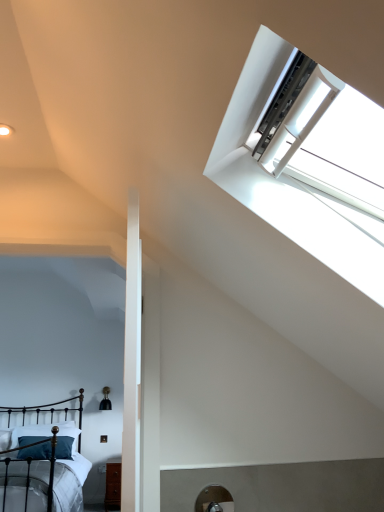
In order to click on dark blue fabric pillow at lower left in this screenshot , I will do `click(35, 448)`.

Describe the element at coordinates (42, 483) in the screenshot. I see `black wrought iron bed at lower left` at that location.

Locate an element on the screen. Image resolution: width=384 pixels, height=512 pixels. white plastic window at upper right is located at coordinates (309, 163).

The width and height of the screenshot is (384, 512). I want to click on dark blue fabric pillow at lower left, so click(x=35, y=448).

Considering the sizes of objects dark blue fabric pillow at lower left and white plastic window at upper right in the image provided, who is taller, dark blue fabric pillow at lower left or white plastic window at upper right?

Standing taller between the two is white plastic window at upper right.

Does dark blue fabric pillow at lower left turn towards white plastic window at upper right?

No, dark blue fabric pillow at lower left is not turned towards white plastic window at upper right.

Locate an element on the screen. The height and width of the screenshot is (512, 384). window that appears on the right of dark blue fabric pillow at lower left is located at coordinates (309, 163).

Considering the sizes of objects black wrought iron bed at lower left and white plastic window at upper right in the image provided, who is wider, black wrought iron bed at lower left or white plastic window at upper right?

With larger width is black wrought iron bed at lower left.

Can white plastic window at upper right be found inside black wrought iron bed at lower left?

No, white plastic window at upper right is not a part of black wrought iron bed at lower left.

What's the angular difference between black wrought iron bed at lower left and white plastic window at upper right's facing directions?

The facing directions of black wrought iron bed at lower left and white plastic window at upper right are 91.4 degrees apart.

Considering the sizes of objects black wrought iron bed at lower left and white plastic window at upper right in the image provided, who is shorter, black wrought iron bed at lower left or white plastic window at upper right?

white plastic window at upper right is shorter.

Do you think white plastic window at upper right is within black wrought iron bed at lower left, or outside of it?

white plastic window at upper right lies outside black wrought iron bed at lower left.

From the image's perspective, would you say white plastic window at upper right is positioned over black wrought iron bed at lower left?

Yes, from the image's perspective, white plastic window at upper right is on top of black wrought iron bed at lower left.

Which object is thinner, white plastic window at upper right or black wrought iron bed at lower left?

white plastic window at upper right.

At what (x,y) coordinates should I click in order to perform the action: click on window that appears in front of the black wrought iron bed at lower left. Please return your answer as a coordinate pair (x, y). This screenshot has height=512, width=384. Looking at the image, I should click on pyautogui.click(x=309, y=163).

Could you tell me if black wrought iron bed at lower left is turned towards dark blue fabric pillow at lower left?

Yes.

In terms of height, does black wrought iron bed at lower left look taller or shorter compared to dark blue fabric pillow at lower left?

Considering their sizes, black wrought iron bed at lower left has more height than dark blue fabric pillow at lower left.

Considering the sizes of black wrought iron bed at lower left and dark blue fabric pillow at lower left in the image, is black wrought iron bed at lower left wider or thinner than dark blue fabric pillow at lower left?

In the image, black wrought iron bed at lower left appears to be wider than dark blue fabric pillow at lower left.

Considering their positions, is black wrought iron bed at lower left located in front of or behind dark blue fabric pillow at lower left?

Clearly, black wrought iron bed at lower left is in front of dark blue fabric pillow at lower left.

Is dark blue fabric pillow at lower left inside the boundaries of black wrought iron bed at lower left, or outside?

The correct answer is: inside.

Is dark blue fabric pillow at lower left bigger than black wrought iron bed at lower left?

No.

Is dark blue fabric pillow at lower left touching black wrought iron bed at lower left?

No, dark blue fabric pillow at lower left is not with black wrought iron bed at lower left.

Does point (301, 173) come closer to viewer compared to point (29, 443)?

Yes, it is.

Where is `window in front of the dark blue fabric pillow at lower left`? This screenshot has height=512, width=384. window in front of the dark blue fabric pillow at lower left is located at coordinates (309, 163).

The width and height of the screenshot is (384, 512). I want to click on pillow lying behind the white plastic window at upper right, so click(35, 448).

What are the coordinates of `bed lying on the left of white plastic window at upper right` in the screenshot? It's located at (42, 483).

When comparing their distances from dark blue fabric pillow at lower left, does black wrought iron bed at lower left or white plastic window at upper right seem further?

Among the two, white plastic window at upper right is located further to dark blue fabric pillow at lower left.

Based on their spatial positions, is black wrought iron bed at lower left or dark blue fabric pillow at lower left further from white plastic window at upper right?

dark blue fabric pillow at lower left.

Based on the photo, based on their spatial positions, is white plastic window at upper right or black wrought iron bed at lower left further from dark blue fabric pillow at lower left?

Based on the image, white plastic window at upper right appears to be further to dark blue fabric pillow at lower left.

From the image, which object appears to be farther from black wrought iron bed at lower left, dark blue fabric pillow at lower left or white plastic window at upper right?

white plastic window at upper right is further to black wrought iron bed at lower left.

Based on their spatial positions, is dark blue fabric pillow at lower left or black wrought iron bed at lower left further from white plastic window at upper right?

Based on the image, dark blue fabric pillow at lower left appears to be further to white plastic window at upper right.

When comparing their distances from black wrought iron bed at lower left, does white plastic window at upper right or dark blue fabric pillow at lower left seem further?

white plastic window at upper right lies further to black wrought iron bed at lower left than the other object.

This screenshot has width=384, height=512. What are the coordinates of `bed between white plastic window at upper right and dark blue fabric pillow at lower left in the front-back direction` in the screenshot? It's located at (42, 483).